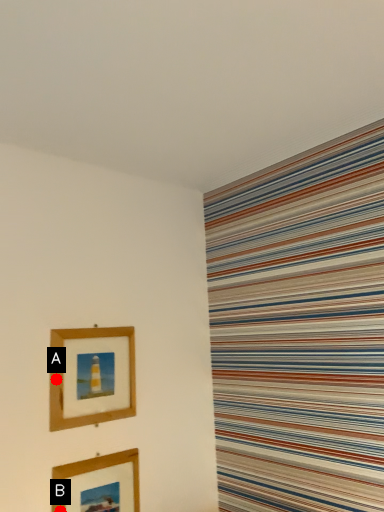
Question: Two points are circled on the image, labeled by A and B beside each circle. Among these points, which one is nearest to the camera?

Choices:
 (A) A is closer
 (B) B is closer

Answer: (B)